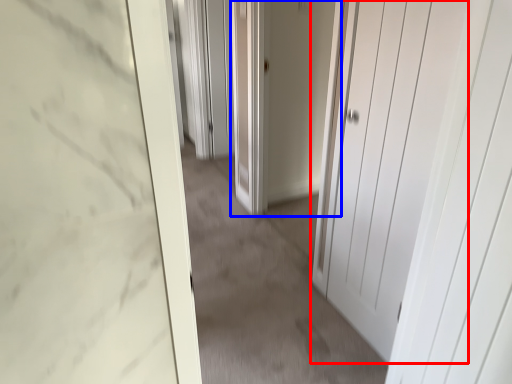
Question: Which object appears closest to the camera in this image, door (highlighted by a red box) or door (highlighted by a blue box)?

Choices:
 (A) door
 (B) door

Answer: (A)